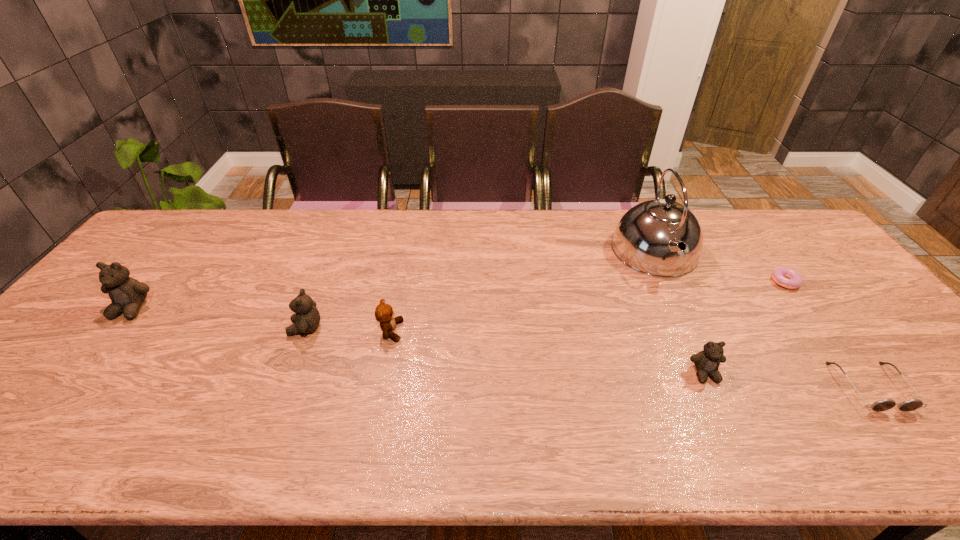
Locate an element on the screen. free space located on the face of the second teddy bear from left to right is located at coordinates (141, 328).

Where is `free space located 0.090m on the face of the second teddy bear from left to right`? free space located 0.090m on the face of the second teddy bear from left to right is located at coordinates (255, 328).

Identify the location of blank space located 0.200m on the face of the second teddy bear from left to right. The image size is (960, 540). (213, 328).

Locate an element on the screen. free space located on the left of the doughnut is located at coordinates (668, 280).

Identify the location of free space located from the spout of the tallest object. This screenshot has height=540, width=960. (713, 376).

I want to click on vacant space located on the front-facing side of the third object from left to right, so click(x=498, y=331).

What are the coordinates of `object at the far edge` in the screenshot? It's located at (646, 238).

What are the coordinates of `teddy bear at the near edge` in the screenshot? It's located at (707, 362).

Where is `sunglasses at the near edge`? This screenshot has height=540, width=960. sunglasses at the near edge is located at coordinates [882, 405].

Where is `object that is positioned at the left edge`? object that is positioned at the left edge is located at coordinates (127, 294).